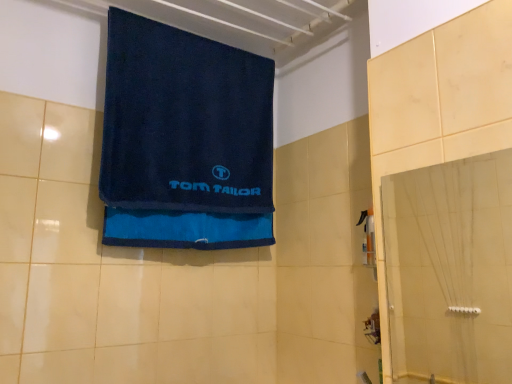
Question: From a real-world perspective, is navy blue terry cloth towel at upper center above or below transparent glass door at right?

Choices:
 (A) below
 (B) above

Answer: (B)

Question: From the image's perspective, is navy blue terry cloth towel at upper center located above or below transparent glass door at right?

Choices:
 (A) above
 (B) below

Answer: (A)

Question: Does point (159, 190) appear closer or farther from the camera than point (507, 369)?

Choices:
 (A) closer
 (B) farther

Answer: (A)

Question: From a real-world perspective, is transparent glass door at right physically located above or below navy blue terry cloth towel at upper center?

Choices:
 (A) below
 (B) above

Answer: (A)

Question: Does point (508, 203) appear closer or farther from the camera than point (186, 173)?

Choices:
 (A) closer
 (B) farther

Answer: (B)

Question: Is transparent glass door at right wider or thinner than navy blue terry cloth towel at upper center?

Choices:
 (A) wide
 (B) thin

Answer: (B)

Question: Is transparent glass door at right bigger or smaller than navy blue terry cloth towel at upper center?

Choices:
 (A) small
 (B) big

Answer: (A)